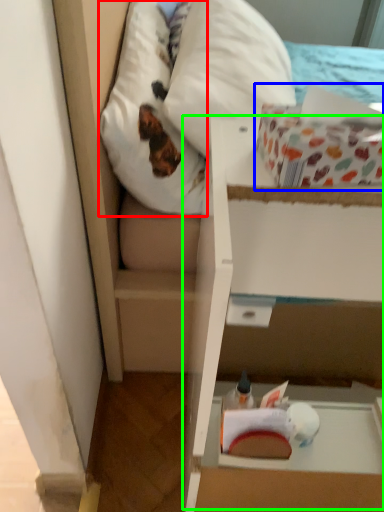
Question: Estimate the real-world distances between objects in this image. Which object is closer to pillow (highlighted by a red box), cardboard box (highlighted by a blue box) or cardboard box (highlighted by a green box)?

Choices:
 (A) cardboard box
 (B) cardboard box

Answer: (B)